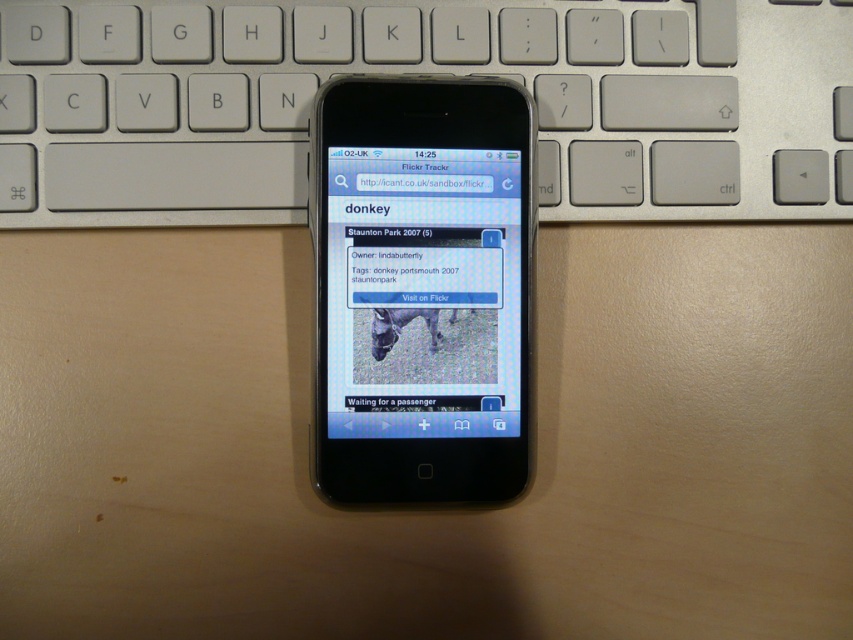
You are holding a smartphone with a black bezel and home button. You want to take a photo of the silver metallic keyboard at center without moving your hand. Can you do this if the camera is 31.19 inches away from the keyboard?

The silver metallic keyboard at center and camera are 31.19 inches apart from each other. Since the camera is part of the smartphone, which is already positioned 31.19 inches away from the keyboard, you can take the photo without moving your hand.

You are a user trying to reach the silver metallic keyboard at center on your desk. Your hand is currently at point (426,72). Is the silver metallic keyboard at center located directly under your hand?

The point (426,72) is where the silver metallic keyboard at center is located, so yes, the silver metallic keyboard at center is directly under your hand at that coordinate.

You are trying to type a message on your smartphone but need to reach the keyboard. The smartphone has a matte black screen at center and a silver metallic keyboard at center. Which object should you move your hand towards to type?

You should move your hand towards the silver metallic keyboard at center because it is positioned on the right side of the matte black screen at center, making it accessible for typing.